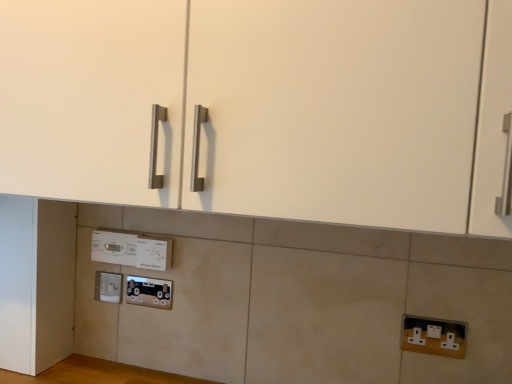
Question: Would you say white plastic thermostat at center is inside or outside metallic socket at lower center?

Choices:
 (A) outside
 (B) inside

Answer: (A)

Question: Considering the positions of white plastic thermostat at center and metallic socket at lower center in the image, is white plastic thermostat at center bigger or smaller than metallic socket at lower center?

Choices:
 (A) big
 (B) small

Answer: (A)

Question: Based on their relative distances, which object is farther from the white matte door at lower left?

Choices:
 (A) white plastic electric outlet at lower left, which is the first electric outlet in back-to-front order
 (B) white plastic electric outlet at lower center, which is counted as the 2th electric outlet, starting from the back
 (C) metallic socket at lower center
 (D) white plastic electric outlet at lower right, the first electric outlet viewed from the front
 (E) white plastic thermostat at center

Answer: (D)

Question: Which object is the farthest from the white plastic electric outlet at lower center, the 2th electric outlet positioned from the left?

Choices:
 (A) white plastic thermostat at center
 (B) white plastic electric outlet at lower left, which ranks as the third electric outlet in right-to-left order
 (C) white plastic electric outlet at lower right, the 3th electric outlet from the top
 (D) metallic socket at lower center
 (E) white matte door at lower left

Answer: (C)